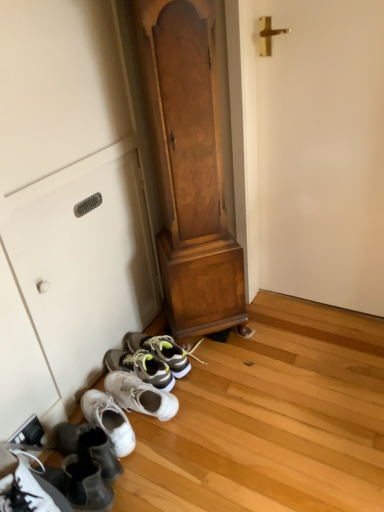
The width and height of the screenshot is (384, 512). I want to click on free space to the left of white matte door at right, so click(261, 339).